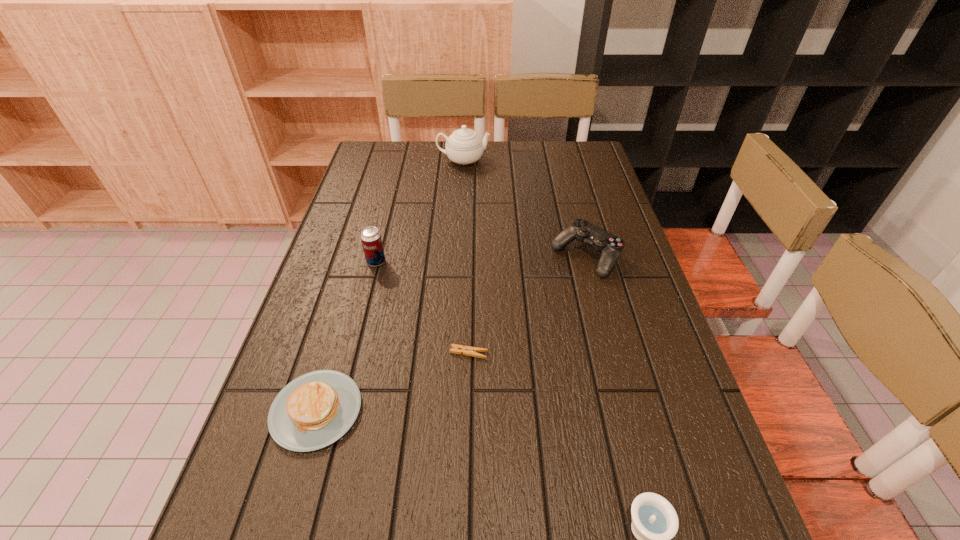
The height and width of the screenshot is (540, 960). I want to click on the farthest object, so tap(464, 146).

The width and height of the screenshot is (960, 540). Identify the location of chinaware. (464, 146).

Find the location of a particular element. Image resolution: width=960 pixels, height=540 pixels. beer can is located at coordinates (371, 240).

This screenshot has height=540, width=960. In order to click on the fourth shortest object in this screenshot , I will do `click(610, 246)`.

The image size is (960, 540). Identify the location of the fifth tallest object. (313, 411).

Where is `the second nearest object`? Image resolution: width=960 pixels, height=540 pixels. the second nearest object is located at coordinates pos(313,411).

You are a GUI agent. You are given a task and a screenshot of the screen. Output one action in this format:
    pyautogui.click(x=<x>, y=<y>)
    Task: Click on the fourth farthest object
    This screenshot has height=540, width=960.
    Given the screenshot: What is the action you would take?
    pyautogui.click(x=456, y=349)

Where is `the shortest object`? the shortest object is located at coordinates (456, 349).

The height and width of the screenshot is (540, 960). Identify the location of vacant region located on the spout of the farthest object. (576, 161).

Where is `vacant space situated on the front of the beer can`? This screenshot has height=540, width=960. vacant space situated on the front of the beer can is located at coordinates (364, 310).